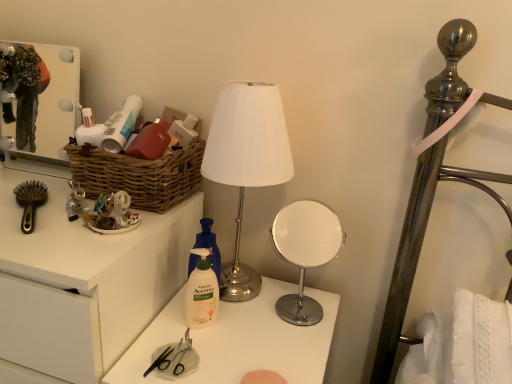
Identify the location of vacant area that lies between white matte lamp at center and metallic silver scissors at center. (219, 337).